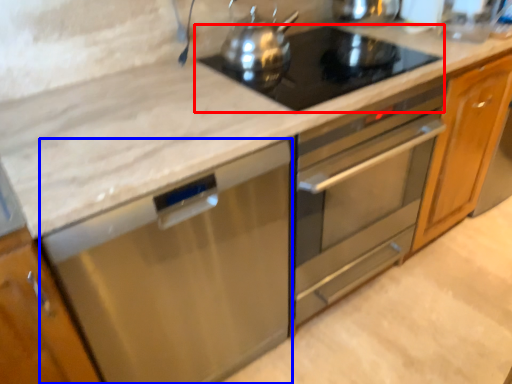
Question: Which of the following is the farthest to the observer, gas stove (highlighted by a red box) or dish washer (highlighted by a blue box)?

Choices:
 (A) gas stove
 (B) dish washer

Answer: (A)